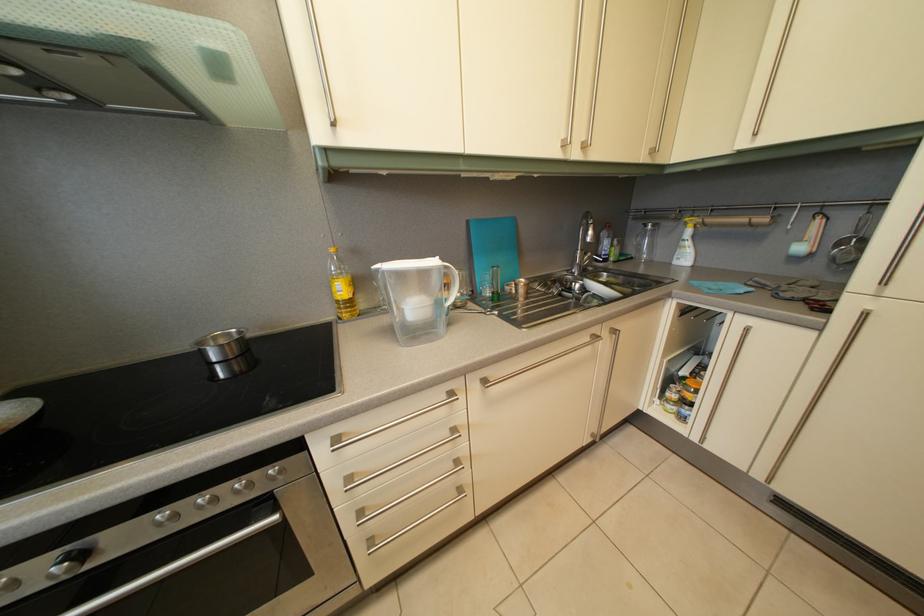
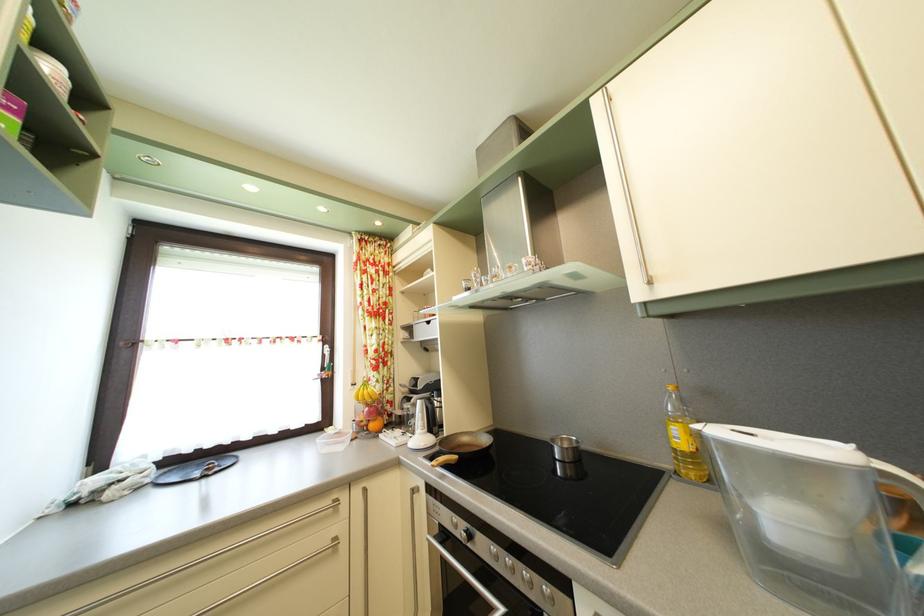
Where in the second image is the point corresponding to pixel 263 482 from the first image?

(543, 585)